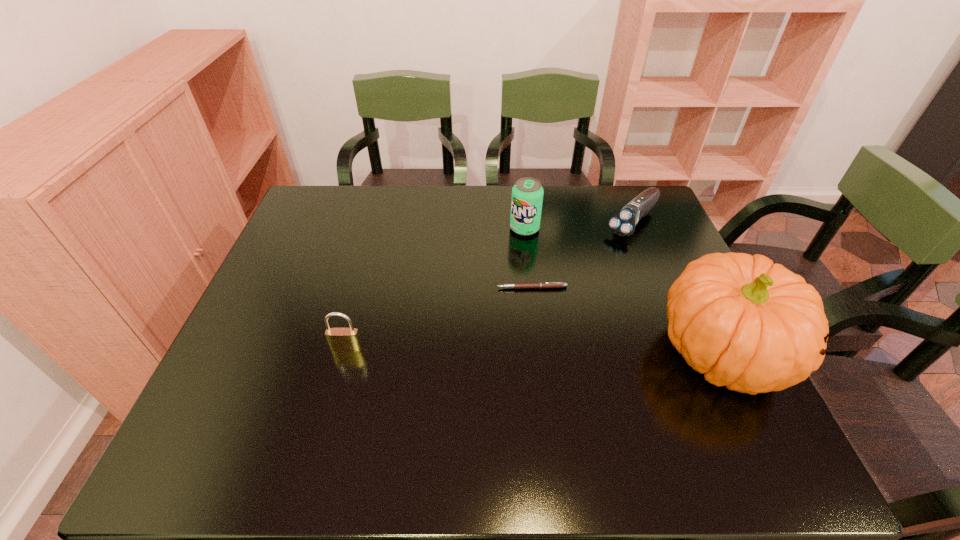
The width and height of the screenshot is (960, 540). I want to click on free space on the desktop that is between the third tallest object and the tallest object and is positioned on the head of the electric shaver, so click(x=502, y=350).

You are a GUI agent. You are given a task and a screenshot of the screen. Output one action in this format:
    pyautogui.click(x=<x>, y=<y>)
    Task: Click on the vacant space on the desktop that is between the third shortest object and the tallest object and is positioned on the front-facing side of the pop soda
    
    Given the screenshot: What is the action you would take?
    (x=479, y=350)

Find the location of `free spot on the desktop that is between the leftmost object and the pumpkin and is positioned at the nib of the pen`. free spot on the desktop that is between the leftmost object and the pumpkin and is positioned at the nib of the pen is located at coordinates (486, 350).